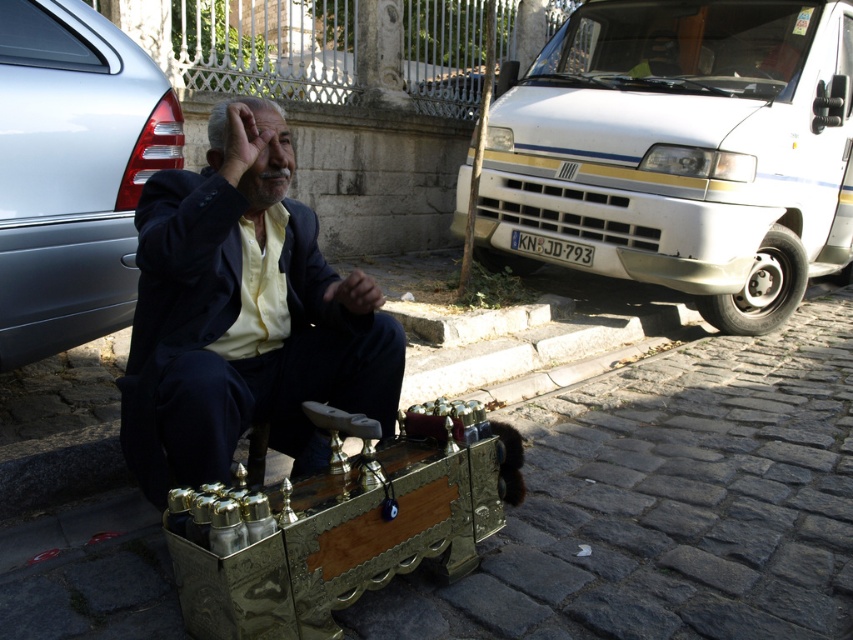
Question: Considering the relative positions of white metallic van at upper right and metallic silver car at left in the image provided, where is white metallic van at upper right located with respect to metallic silver car at left?

Choices:
 (A) left
 (B) right

Answer: (B)

Question: Does white metallic van at upper right have a lesser width compared to matte black suit at center?

Choices:
 (A) yes
 (B) no

Answer: (B)

Question: Which point is farther to the camera?

Choices:
 (A) metallic silver car at left
 (B) matte black suit at center
 (C) white metallic van at upper right

Answer: (C)

Question: Which of the following is the closest to the observer?

Choices:
 (A) matte black suit at center
 (B) white metallic van at upper right

Answer: (A)

Question: Is white metallic van at upper right positioned before matte black suit at center?

Choices:
 (A) yes
 (B) no

Answer: (B)

Question: Which of the following is the farthest from the observer?

Choices:
 (A) (624, 244)
 (B) (204, 250)
 (C) (80, 99)

Answer: (A)